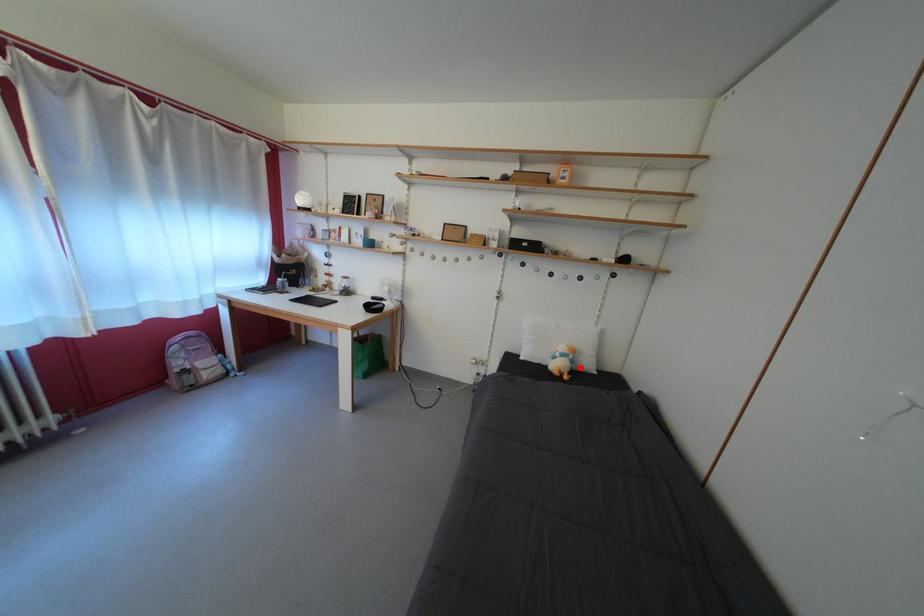
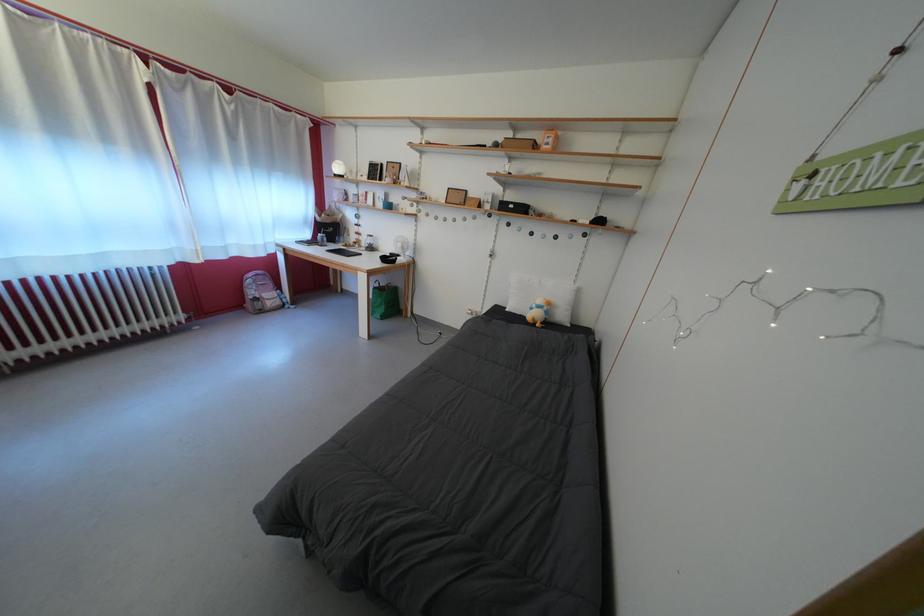
The point at the highlighted location is marked in the first image. Where is the corresponding point in the second image?

(554, 318)